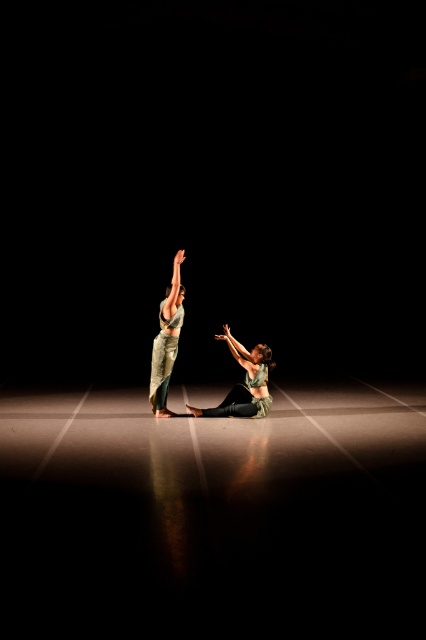
Which of these two, green fabric skirt at center or matte green fabric at center, stands shorter?

With less height is green fabric skirt at center.

Does green fabric skirt at center appear on the left side of matte green fabric at center?

Incorrect, green fabric skirt at center is not on the left side of matte green fabric at center.

Who is more forward, (x=221, y=339) or (x=166, y=344)?

Point (x=166, y=344)

Locate an element on the screen. The image size is (426, 640). green fabric skirt at center is located at coordinates (244, 381).